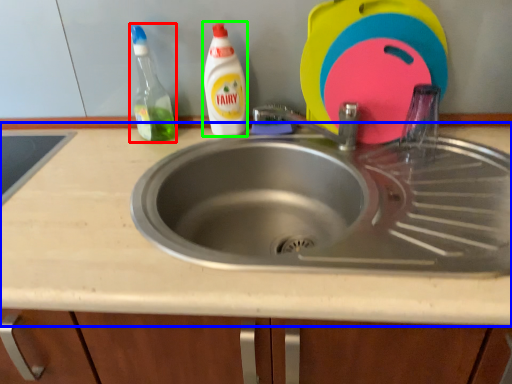
Question: Which object is positioned farthest from cleaning product (highlighted by a red box)? Select from countertop (highlighted by a blue box) and cleaning product (highlighted by a green box).

Choices:
 (A) countertop
 (B) cleaning product

Answer: (A)